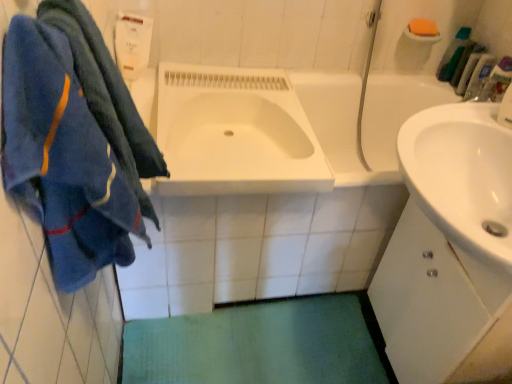
Question: Does green plastic bottles at upper right, placed as the second toiletry when sorted from bottom to top, have a greater width compared to green plastic toothbrush at upper right, marked as the first toiletry in a top-to-bottom arrangement?

Choices:
 (A) no
 (B) yes

Answer: (B)

Question: Is green plastic bottles at upper right, positioned as the second toiletry in top-to-bottom order, positioned before green plastic toothbrush at upper right, marked as the first toiletry in a top-to-bottom arrangement?

Choices:
 (A) yes
 (B) no

Answer: (A)

Question: Is green plastic bottles at upper right, positioned as the second toiletry in top-to-bottom order, with green plastic toothbrush at upper right, marked as the first toiletry in a top-to-bottom arrangement?

Choices:
 (A) no
 (B) yes

Answer: (B)

Question: Is green plastic bottles at upper right, positioned as the second toiletry in top-to-bottom order, thinner than green plastic toothbrush at upper right, positioned as the third toiletry in bottom-to-top order?

Choices:
 (A) no
 (B) yes

Answer: (A)

Question: Is green plastic bottles at upper right, placed as the second toiletry when sorted from bottom to top, shorter than green plastic toothbrush at upper right, marked as the first toiletry in a top-to-bottom arrangement?

Choices:
 (A) yes
 (B) no

Answer: (A)

Question: Is clear plastic bottle at upper right, the third toiletry positioned from the top, taller or shorter than green fabric bath mat at lower center?

Choices:
 (A) short
 (B) tall

Answer: (B)

Question: From the image's perspective, is clear plastic bottle at upper right, marked as the 1th toiletry in a bottom-to-top arrangement, positioned above or below green fabric bath mat at lower center?

Choices:
 (A) above
 (B) below

Answer: (A)

Question: Considering the positions of clear plastic bottle at upper right, marked as the 1th toiletry in a bottom-to-top arrangement, and green fabric bath mat at lower center in the image, is clear plastic bottle at upper right, marked as the 1th toiletry in a bottom-to-top arrangement, bigger or smaller than green fabric bath mat at lower center?

Choices:
 (A) big
 (B) small

Answer: (B)

Question: Is clear plastic bottle at upper right, the third toiletry positioned from the top, inside the boundaries of green fabric bath mat at lower center, or outside?

Choices:
 (A) inside
 (B) outside

Answer: (B)

Question: Looking at their shapes, would you say orange sponge at upper right is wider or thinner than white matte cabinet at right?

Choices:
 (A) thin
 (B) wide

Answer: (A)

Question: From the image's perspective, is orange sponge at upper right above or below white matte cabinet at right?

Choices:
 (A) above
 (B) below

Answer: (A)

Question: Relative to white matte cabinet at right, is orange sponge at upper right in front or behind?

Choices:
 (A) behind
 (B) front

Answer: (A)

Question: In terms of size, does orange sponge at upper right appear bigger or smaller than white matte cabinet at right?

Choices:
 (A) small
 (B) big

Answer: (A)

Question: Looking at the image, does blue fuzzy towel at left seem bigger or smaller compared to white glossy sink at center?

Choices:
 (A) small
 (B) big

Answer: (A)

Question: In terms of width, does blue fuzzy towel at left look wider or thinner when compared to white glossy sink at center?

Choices:
 (A) thin
 (B) wide

Answer: (A)